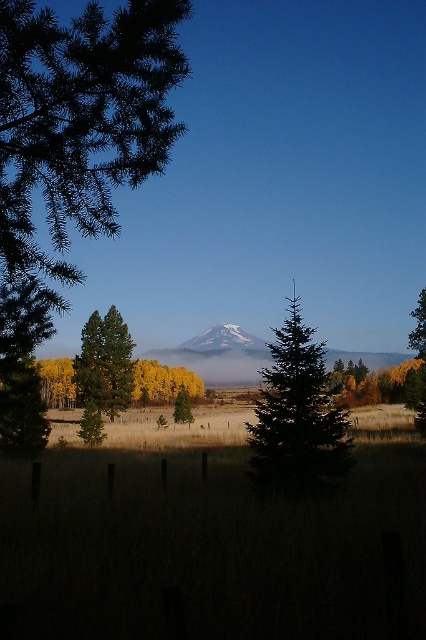
Question: Which of the following is the closest to the observer?

Choices:
 (A) click(x=298, y=484)
 (B) click(x=25, y=426)
 (C) click(x=8, y=424)
 (D) click(x=184, y=397)

Answer: (A)

Question: Which object appears farthest from the camera in this image?

Choices:
 (A) green matte tree at left
 (B) green matte tree at center

Answer: (B)

Question: Which is farther from the green textured pine tree at left?

Choices:
 (A) white snow-covered mountain at center
 (B) green matte tree at center
 (C) green matte tree at left
 (D) green matte evergreen tree at center

Answer: (A)

Question: Does green matte tree at left lie behind green matte evergreen tree at center?

Choices:
 (A) yes
 (B) no

Answer: (B)

Question: Does green textured pine tree at left appear on the left side of green matte tree at center?

Choices:
 (A) yes
 (B) no

Answer: (A)

Question: Is green matte tree at left smaller than white snow-covered mountain at center?

Choices:
 (A) no
 (B) yes

Answer: (A)